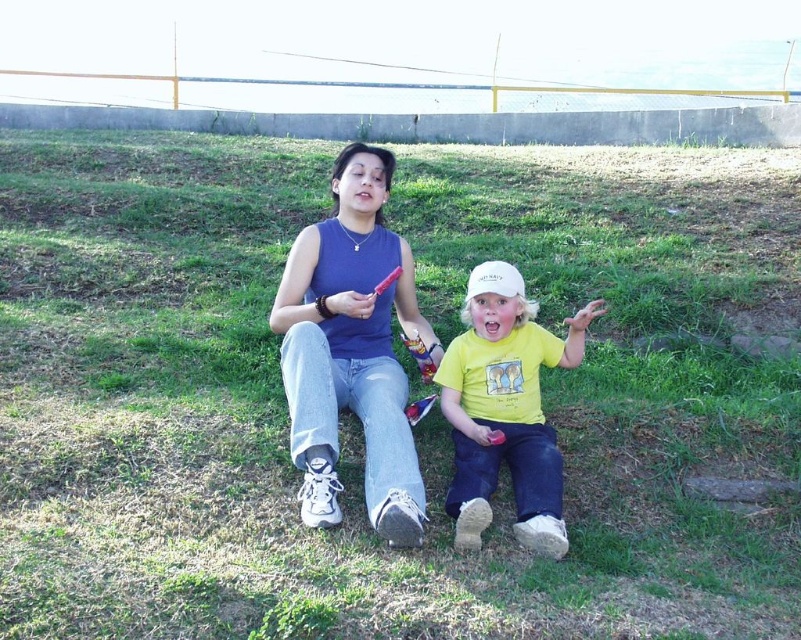
Consider the image. Measure the distance between matte blue tank top at center and yellow cotton shirt at center.

matte blue tank top at center and yellow cotton shirt at center are 22.07 inches apart.

Does point (369, 198) come closer to viewer compared to point (493, 264)?

No, (369, 198) is further to viewer.

Identify the location of matte blue tank top at center. Image resolution: width=801 pixels, height=640 pixels. (352, 349).

Which is above, yellow cotton shirt at center or white matte baseball hat at center?

white matte baseball hat at center

Is point (554, 545) positioned in front of point (513, 284)?

Yes, point (554, 545) is in front of point (513, 284).

Is point (544, 540) closer to viewer compared to point (490, 289)?

Yes.

At what (x,y) coordinates should I click in order to perform the action: click on yellow cotton shirt at center. Please return your answer as a coordinate pair (x, y). Looking at the image, I should click on (505, 410).

Does matte blue tank top at center appear on the right side of white matte baseball hat at center?

In fact, matte blue tank top at center is to the left of white matte baseball hat at center.

Who is shorter, matte blue tank top at center or white matte baseball hat at center?

white matte baseball hat at center is shorter.

Is point (332, 304) less distant than point (501, 294)?

No, it is not.

At what (x,y) coordinates should I click in order to perform the action: click on matte blue tank top at center. Please return your answer as a coordinate pair (x, y). Looking at the image, I should click on (352, 349).